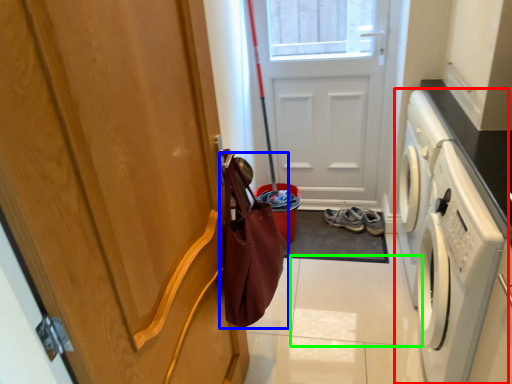
Question: Which is nearer to the washing machine (highlighted by a red box)? shopping bag (highlighted by a blue box) or tile (highlighted by a green box).

Choices:
 (A) shopping bag
 (B) tile

Answer: (B)